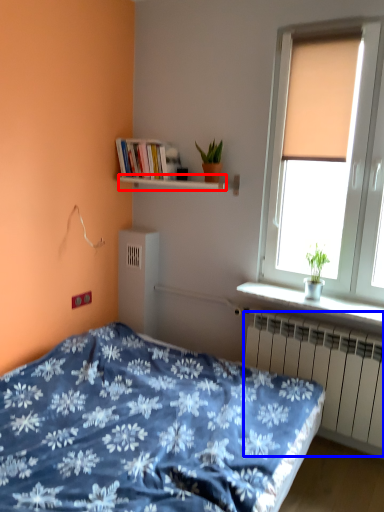
Question: Which point is further to the camera, window sill (highlighted by a red box) or radiator (highlighted by a blue box)?

Choices:
 (A) window sill
 (B) radiator

Answer: (A)